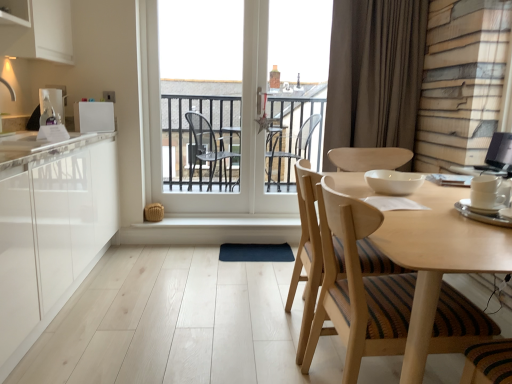
Image resolution: width=512 pixels, height=384 pixels. Identify the location of vacant space to the left of wooden chair with striped cushion at center. coord(234,322).